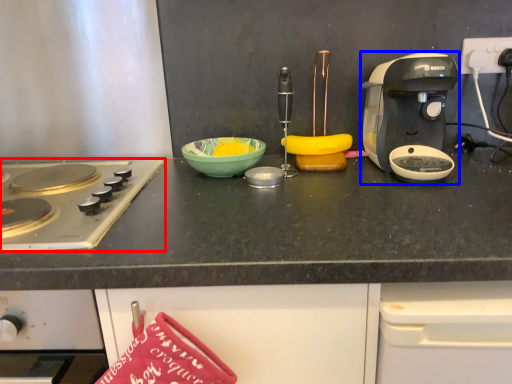
Question: Which object is closer to the camera taking this photo, gas stove (highlighted by a red box) or coffee maker (highlighted by a blue box)?

Choices:
 (A) gas stove
 (B) coffee maker

Answer: (A)